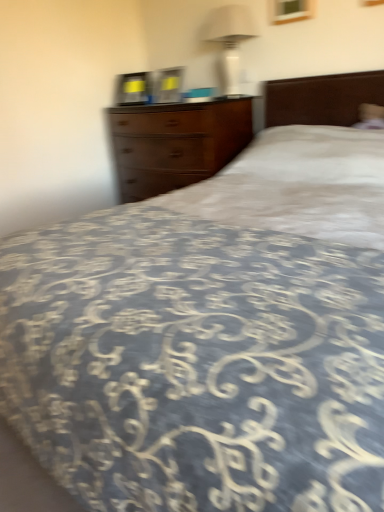
Identify the location of wooden chest of drawers at center. (175, 144).

The image size is (384, 512). Describe the element at coordinates (175, 144) in the screenshot. I see `wooden chest of drawers at center` at that location.

This screenshot has width=384, height=512. I want to click on white glossy lampshade at upper center, so click(230, 41).

The width and height of the screenshot is (384, 512). Describe the element at coordinates (230, 41) in the screenshot. I see `white glossy lampshade at upper center` at that location.

Image resolution: width=384 pixels, height=512 pixels. I want to click on wooden chest of drawers at center, so pos(175,144).

Considering the relative positions of wooden chest of drawers at center and white glossy lampshade at upper center in the image provided, is wooden chest of drawers at center to the right of white glossy lampshade at upper center from the viewer's perspective?

In fact, wooden chest of drawers at center is to the left of white glossy lampshade at upper center.

Which object is more forward, wooden chest of drawers at center or white glossy lampshade at upper center?

wooden chest of drawers at center is closer to the camera.

Looking at this image, which point is more distant from viewer, (223,130) or (256,36)?

Positioned behind is point (256,36).

From the image's perspective, which one is positioned lower, wooden chest of drawers at center or white glossy lampshade at upper center?

wooden chest of drawers at center appears lower in the image.

From a real-world perspective, who is located higher, wooden chest of drawers at center or white glossy lampshade at upper center?

white glossy lampshade at upper center, from a real-world perspective.

Between wooden chest of drawers at center and white glossy lampshade at upper center, which one has larger width?

Wider between the two is wooden chest of drawers at center.

Considering the relative sizes of wooden chest of drawers at center and white glossy lampshade at upper center in the image provided, is wooden chest of drawers at center shorter than white glossy lampshade at upper center?

Incorrect, the height of wooden chest of drawers at center does not fall short of that of white glossy lampshade at upper center.

Is wooden chest of drawers at center smaller than white glossy lampshade at upper center?

Actually, wooden chest of drawers at center might be larger than white glossy lampshade at upper center.

Is white glossy lampshade at upper center surrounded by wooden chest of drawers at center?

No.

Is wooden chest of drawers at center not near white glossy lampshade at upper center?

No, wooden chest of drawers at center is not far away from white glossy lampshade at upper center.

Is wooden chest of drawers at center turned away from white glossy lampshade at upper center?

No, wooden chest of drawers at center is not facing away from white glossy lampshade at upper center.

This screenshot has width=384, height=512. Identify the location of the chest of drawers that is under the white glossy lampshade at upper center (from a real-world perspective). (175, 144).

Considering the positions of objects white glossy lampshade at upper center and wooden chest of drawers at center in the image provided, who is more to the left, white glossy lampshade at upper center or wooden chest of drawers at center?

Positioned to the left is wooden chest of drawers at center.

Does white glossy lampshade at upper center come in front of wooden chest of drawers at center?

No, white glossy lampshade at upper center is further to the viewer.

Which is nearer, (227, 78) or (209, 144)?

Point (227, 78) appears to be farther away from the viewer than point (209, 144).

From the image's perspective, which object appears higher, white glossy lampshade at upper center or wooden chest of drawers at center?

white glossy lampshade at upper center is shown above in the image.

From a real-world perspective, is white glossy lampshade at upper center physically located above or below wooden chest of drawers at center?

white glossy lampshade at upper center is situated higher than wooden chest of drawers at center in the real world.

Considering the sizes of objects white glossy lampshade at upper center and wooden chest of drawers at center in the image provided, who is thinner, white glossy lampshade at upper center or wooden chest of drawers at center?

white glossy lampshade at upper center is thinner.

In terms of height, does white glossy lampshade at upper center look taller or shorter compared to wooden chest of drawers at center?

In the image, white glossy lampshade at upper center appears to be shorter than wooden chest of drawers at center.

Can you confirm if white glossy lampshade at upper center is smaller than wooden chest of drawers at center?

Yes.

Is white glossy lampshade at upper center located outside wooden chest of drawers at center?

Indeed, white glossy lampshade at upper center is completely outside wooden chest of drawers at center.

Does white glossy lampshade at upper center touch wooden chest of drawers at center?

white glossy lampshade at upper center and wooden chest of drawers at center are clearly separated.

Is wooden chest of drawers at center at the back of white glossy lampshade at upper center?

white glossy lampshade at upper center does not have its back to wooden chest of drawers at center.

What's the angular difference between white glossy lampshade at upper center and wooden chest of drawers at center's facing directions?

The angular difference between white glossy lampshade at upper center and wooden chest of drawers at center is 4.61 degrees.

The width and height of the screenshot is (384, 512). I want to click on bedside lamp positioned vertically above the wooden chest of drawers at center (from a real-world perspective), so [230, 41].

Where is `the chest of drawers lying below the white glossy lampshade at upper center (from the image's perspective)`? The width and height of the screenshot is (384, 512). the chest of drawers lying below the white glossy lampshade at upper center (from the image's perspective) is located at coordinates (175, 144).

Where is `bedside lamp lying behind the wooden chest of drawers at center`? This screenshot has height=512, width=384. bedside lamp lying behind the wooden chest of drawers at center is located at coordinates (230, 41).